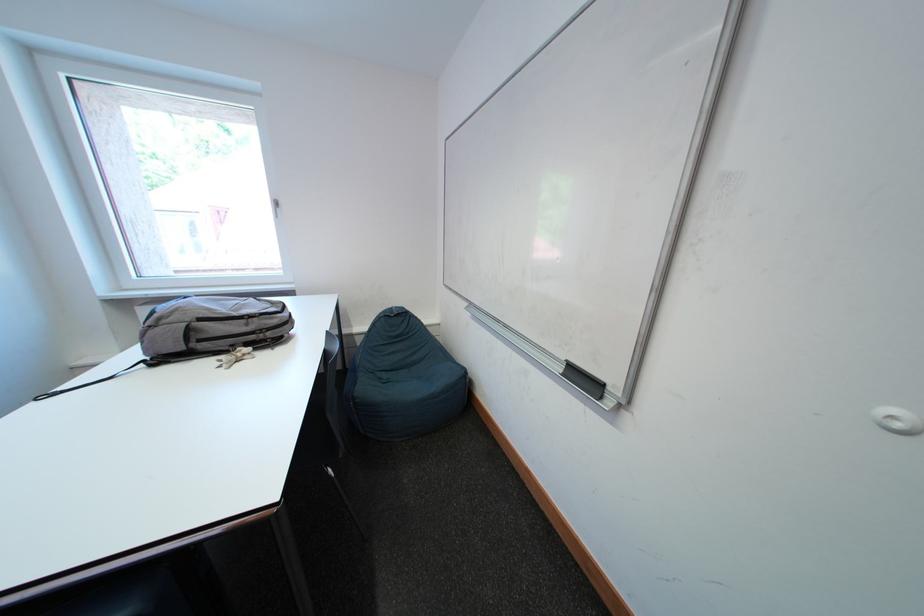
What do you see at coordinates (249, 320) in the screenshot?
I see `a backpack zipper pull` at bounding box center [249, 320].